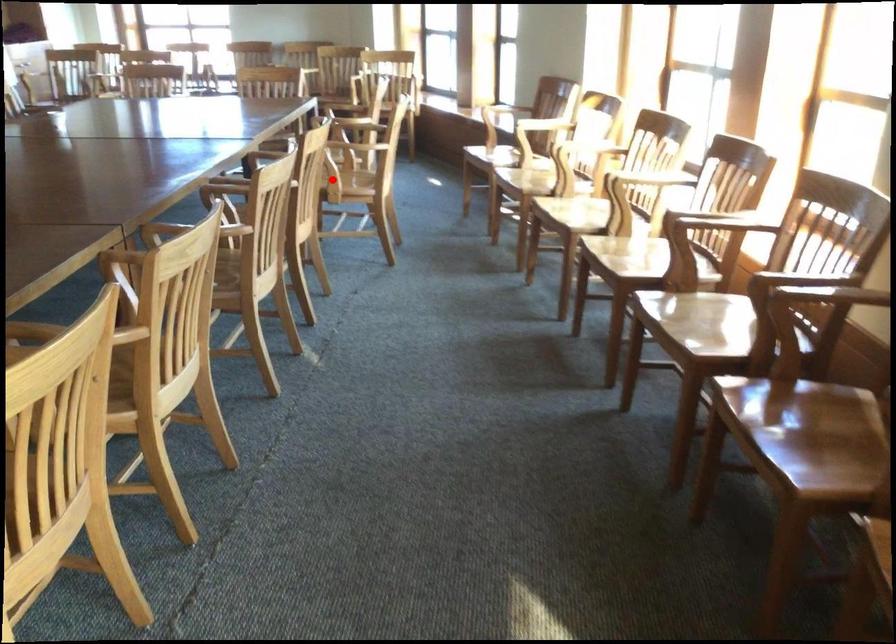
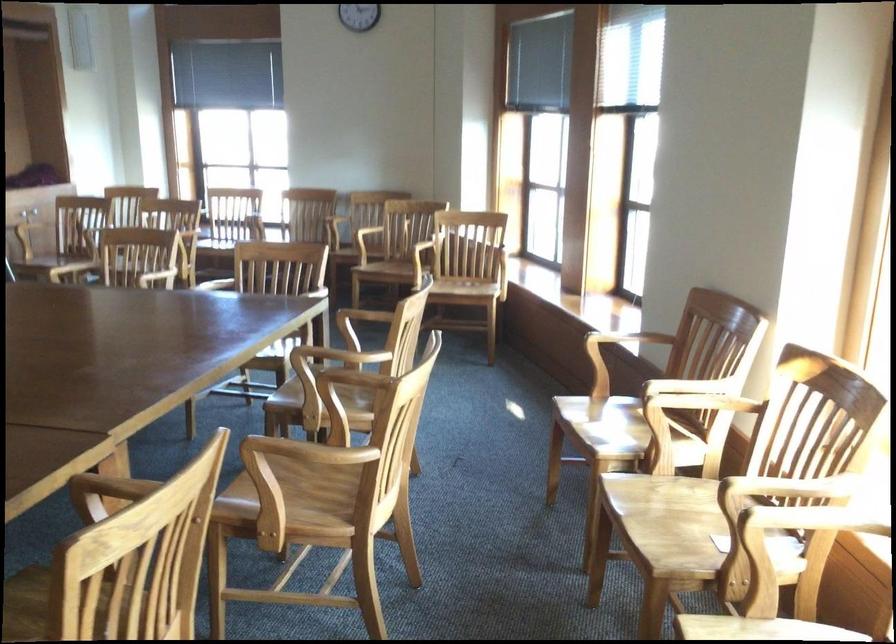
Question: A red point is marked in image1. In image2, is the corresponding 3D point closer to the camera or farther? Reply with the corresponding letter.

Choices:
 (A) The corresponding 3D point is closer.
 (B) The corresponding 3D point is farther.

Answer: (A)